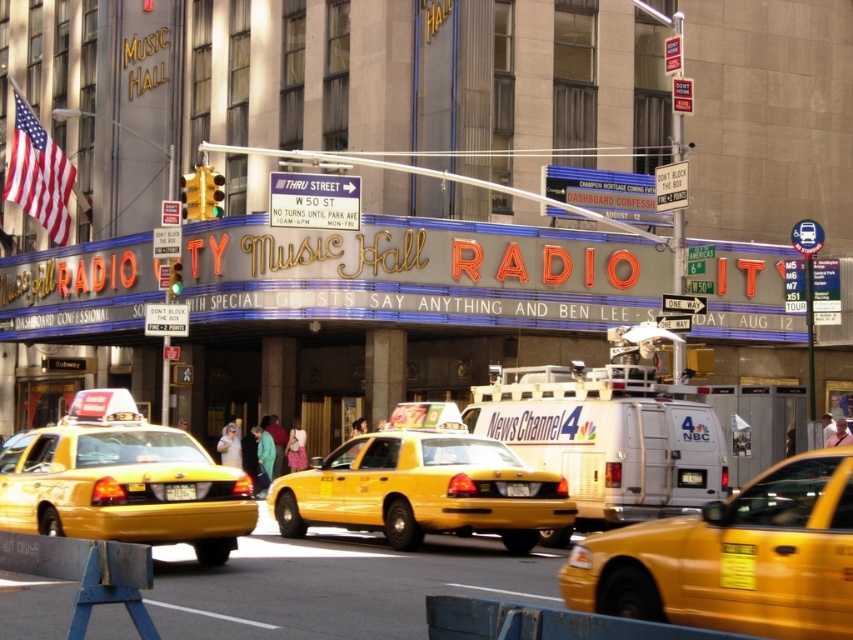
Question: In this image, where is yellow rubber taxi at center located relative to yellow plastic taxi at center?

Choices:
 (A) left
 (B) right

Answer: (B)

Question: Which point is farther to the camera?

Choices:
 (A) yellow rubber taxi at center
 (B) white metallic van at center
 (C) yellow plastic taxi at center
 (D) white plastic sign at upper center

Answer: (D)

Question: Can you confirm if white metallic van at center is smaller than yellow plastic taxi at center?

Choices:
 (A) no
 (B) yes

Answer: (A)

Question: Which point is closer to the camera?

Choices:
 (A) white plastic sign at upper center
 (B) yellow rubber taxi at center
 (C) yellow plastic taxi cab at center

Answer: (B)

Question: Can you confirm if yellow plastic taxi cab at center is positioned to the left of yellow plastic taxi at center?

Choices:
 (A) no
 (B) yes

Answer: (B)

Question: Considering the real-world distances, which object is closest to the white plastic sign at upper center?

Choices:
 (A) yellow rubber taxi at center
 (B) white metallic van at center

Answer: (B)